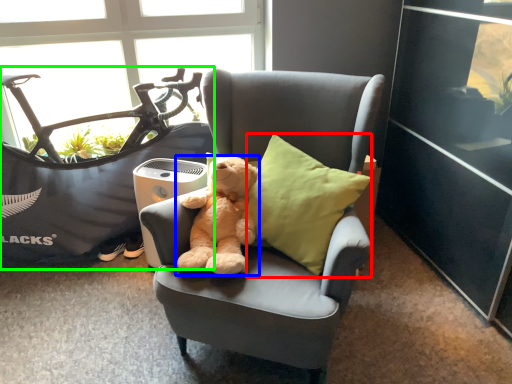
Question: Estimate the real-world distances between objects in this image. Which object is closer to pillow (highlighted by a red box), teddy bear (highlighted by a blue box) or mountain bike (highlighted by a green box)?

Choices:
 (A) teddy bear
 (B) mountain bike

Answer: (A)